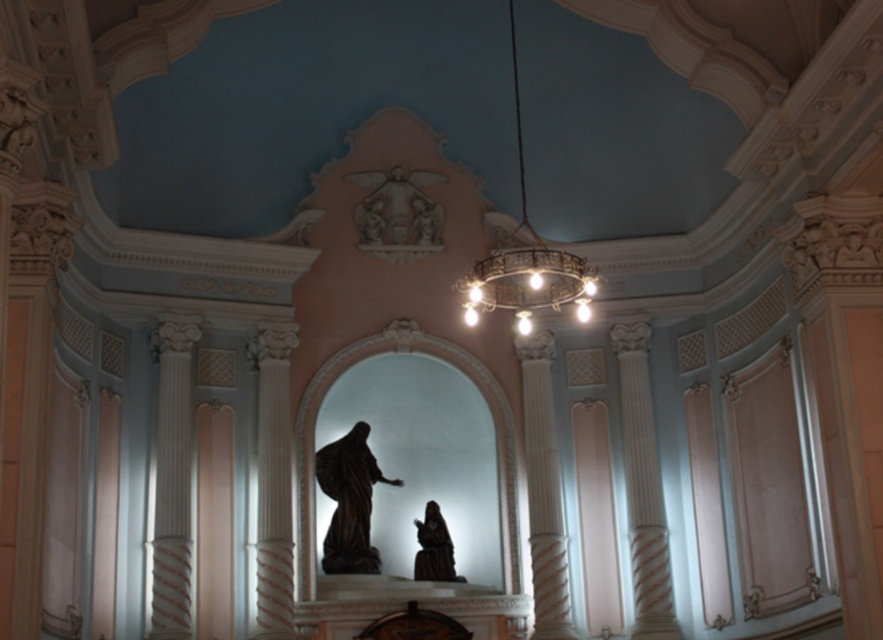
Can you confirm if dark brown polished wood statue at center is smaller than white stone sculpture at upper center?

No.

Which is behind, point (357, 452) or point (379, 180)?

The point (379, 180) is more distant.

Where is `dark brown polished wood statue at center`? This screenshot has width=883, height=640. dark brown polished wood statue at center is located at coordinates (349, 500).

The height and width of the screenshot is (640, 883). Describe the element at coordinates (349, 500) in the screenshot. I see `dark brown polished wood statue at center` at that location.

Can you confirm if dark brown polished wood statue at center is smaller than dark brown wood statue at center?

No, dark brown polished wood statue at center is not smaller than dark brown wood statue at center.

Does point (334, 481) come closer to viewer compared to point (442, 536)?

That is True.

What are the coordinates of `dark brown polished wood statue at center` in the screenshot? It's located at (349, 500).

What do you see at coordinates (398, 214) in the screenshot?
I see `white stone sculpture at upper center` at bounding box center [398, 214].

Is white stone sculpture at upper center to the right of dark brown wood statue at center from the viewer's perspective?

Incorrect, white stone sculpture at upper center is not on the right side of dark brown wood statue at center.

Locate an element on the screen. The height and width of the screenshot is (640, 883). white stone sculpture at upper center is located at coordinates (398, 214).